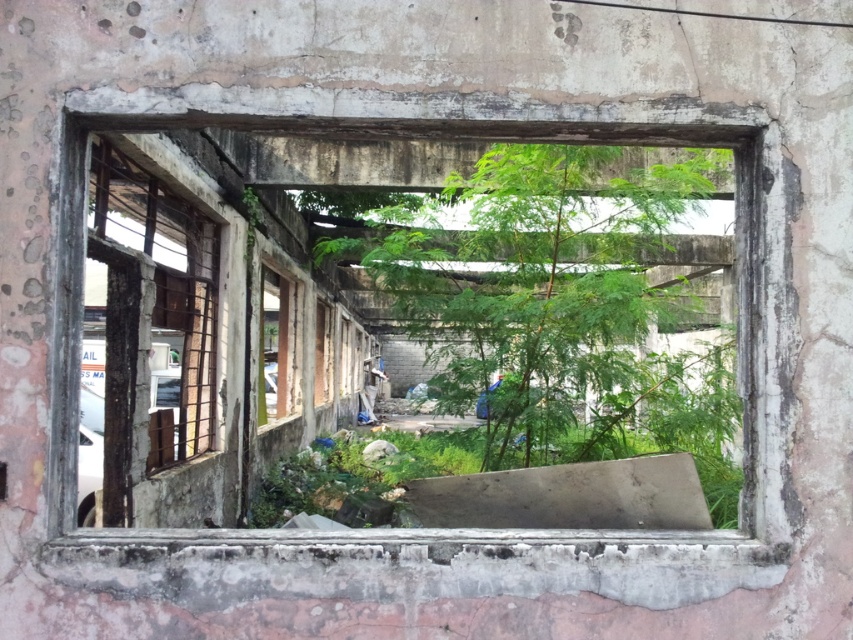
You are standing in front of the building and want to see the green leafy tree at center through the rusty concrete window frame at center. Can you see the tree through the window?

The rusty concrete window frame at center is positioned under the green leafy tree at center, so yes, you can see the green leafy tree at center through the window because the tree is above the window frame.

You are an architect assessing the building. You notice the green leafy tree at center and the rusty metal window at left. Which object occupies more space in the image?

The green leafy tree at center has a larger size compared to the rusty metal window at left, so it occupies more space in the image.

You are an architect assessing the building. You need to determine if the green leafy tree at center could be seen entirely through the rusty concrete window frame at center. Based on their sizes, is this possible?

The rusty concrete window frame at center has a larger size compared to green leafy tree at center, so the entire tree can be seen through the window frame.